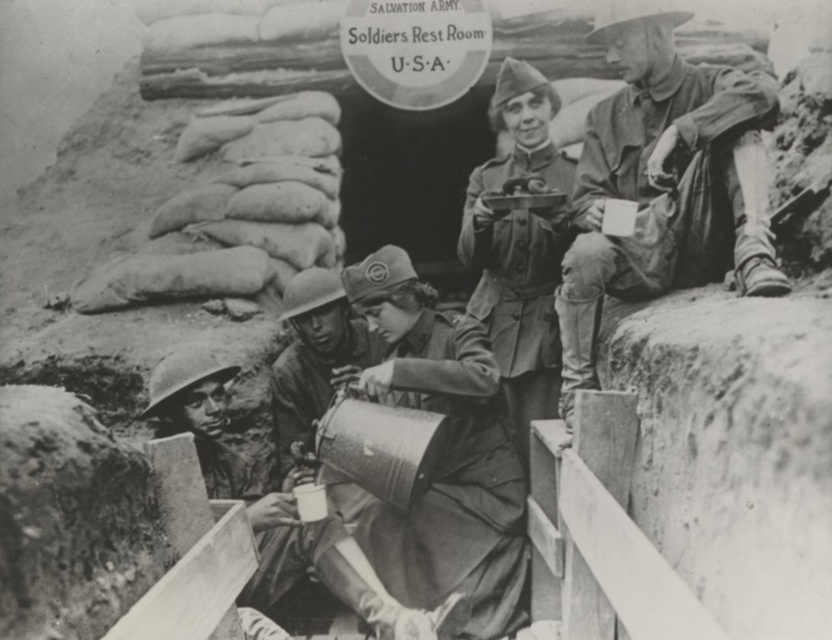
Question: Which object is the farthest from the matte brown uniform at center?

Choices:
 (A) matte khaki uniform at center
 (B) matte metal helmet at lower left

Answer: (A)

Question: Does rugged leather jacket at upper right appear on the right side of matte metal helmet at lower left?

Choices:
 (A) yes
 (B) no

Answer: (A)

Question: Which point is farther to the camera?

Choices:
 (A) matte brown uniform at center
 (B) metallic helmet at center
 (C) matte khaki uniform at center
 (D) matte metal helmet at lower left

Answer: (B)

Question: Does matte brown uniform at center appear over matte metal helmet at lower left?

Choices:
 (A) no
 (B) yes

Answer: (B)

Question: Which object is closer to the camera taking this photo?

Choices:
 (A) metallic helmet at center
 (B) rugged leather jacket at upper right
 (C) matte metal helmet at lower left
 (D) matte brown uniform at center

Answer: (B)

Question: Can you confirm if rugged leather jacket at upper right is positioned below matte khaki uniform at center?

Choices:
 (A) no
 (B) yes

Answer: (A)